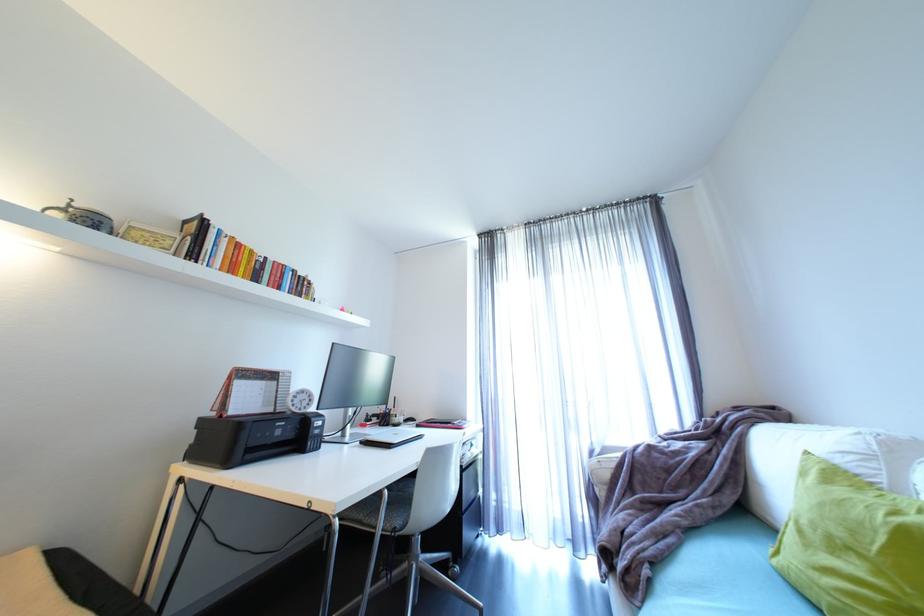
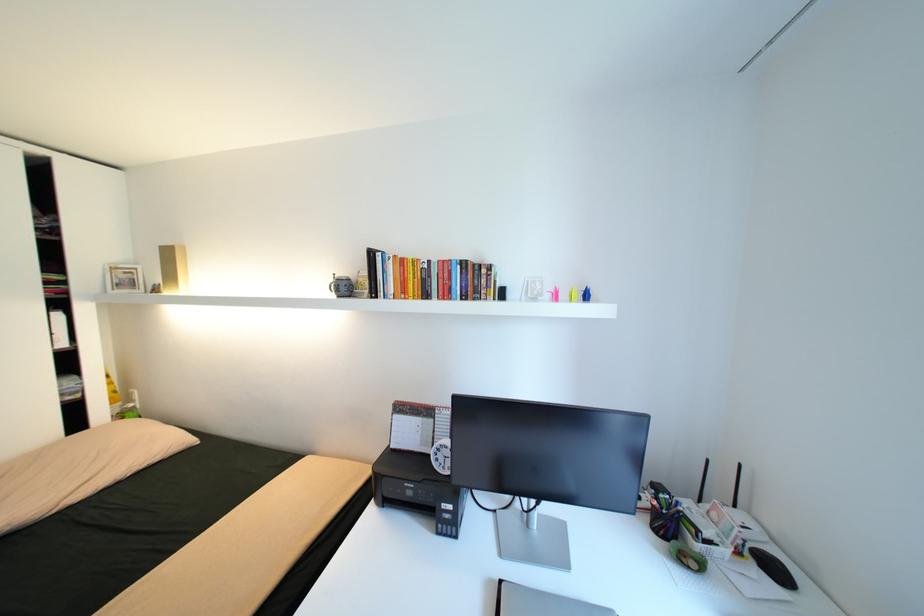
In the second image, find the point that corresponds to (x=104, y=223) in the first image.

(344, 286)